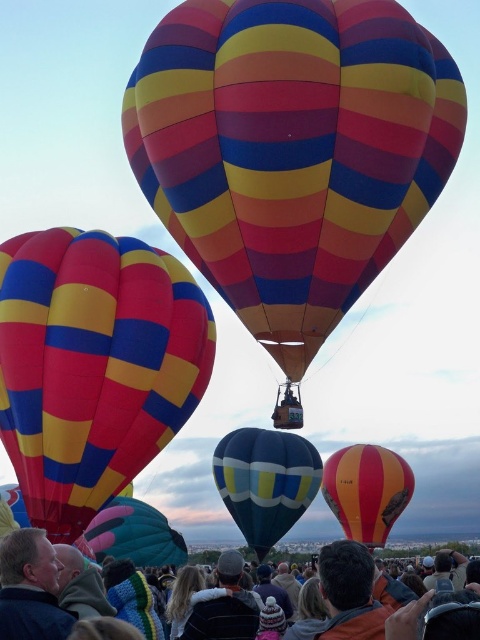
Does multicolored striped hot air balloon at center have a greater height compared to matte multicolored balloon at center?

Yes.

Between multicolored striped hot air balloon at center and matte multicolored balloon at center, which one is positioned higher?

Positioned higher is multicolored striped hot air balloon at center.

Does point (144, 67) lie behind point (178, 538)?

No, it is not.

Locate an element on the screen. multicolored striped hot air balloon at center is located at coordinates (291, 150).

Is matte striped balloon at left further to camera compared to striped fabric hot air balloon at center?

No, it is not.

Who is more distant from viewer, [66,429] or [374,500]?

The point [374,500] is behind.

Where is `matte striped balloon at left`? matte striped balloon at left is located at coordinates (94, 365).

Is point (24, 294) positioned in front of point (239, 566)?

Yes.

Can you confirm if matte striped balloon at left is shorter than dark blue knit hat at center?

No, matte striped balloon at left is not shorter than dark blue knit hat at center.

Who is more forward, (126, 268) or (203, 602)?

Point (203, 602) is in front.

What are the coordinates of `matte striped balloon at left` in the screenshot? It's located at [x=94, y=365].